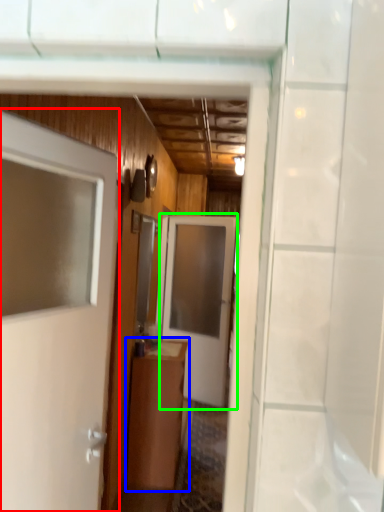
Question: Which object is the closest to the door (highlighted by a red box)? Choose among these: cabinetry (highlighted by a blue box) or door (highlighted by a green box).

Choices:
 (A) cabinetry
 (B) door

Answer: (A)